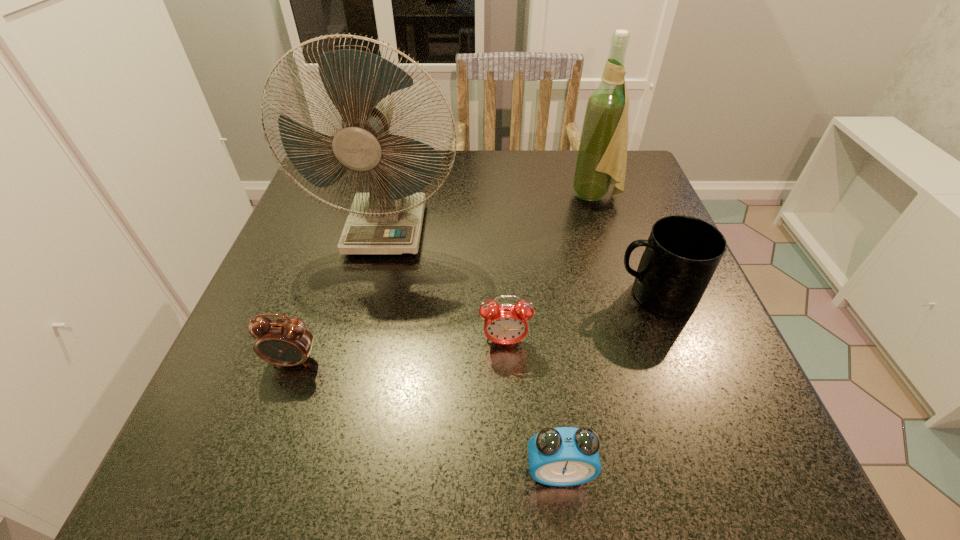
Where is `free space located on the front-facing side of the wine bottle`? The width and height of the screenshot is (960, 540). free space located on the front-facing side of the wine bottle is located at coordinates (511, 196).

Find the location of a particular element. blank area located 0.180m on the front-facing side of the wine bottle is located at coordinates (493, 196).

Identify the location of vacant position located on the side of the third farthest object with the handle. (580, 295).

Find the location of a particular element. vacant area located 0.350m on the side of the third farthest object with the handle is located at coordinates (422, 295).

The height and width of the screenshot is (540, 960). What are the coordinates of `blank space located 0.270m on the side of the third farthest object with the handle` in the screenshot? It's located at (466, 295).

At what (x,y) coordinates should I click in order to perform the action: click on free region located on the face of the fifth farthest object. Please return your answer as a coordinate pair (x, y). Looking at the image, I should click on (271, 424).

The width and height of the screenshot is (960, 540). I want to click on free location located 0.090m on the face of the fourth farthest object, so click(x=508, y=400).

In order to click on fan that is at the far edge in this screenshot , I will do `click(388, 220)`.

At what (x,y) coordinates should I click in order to perform the action: click on wine bottle present at the far edge. Please return your answer as a coordinate pair (x, y). Looking at the image, I should click on (602, 154).

Find the location of a particular element. The image size is (960, 540). object present at the near edge is located at coordinates (563, 456).